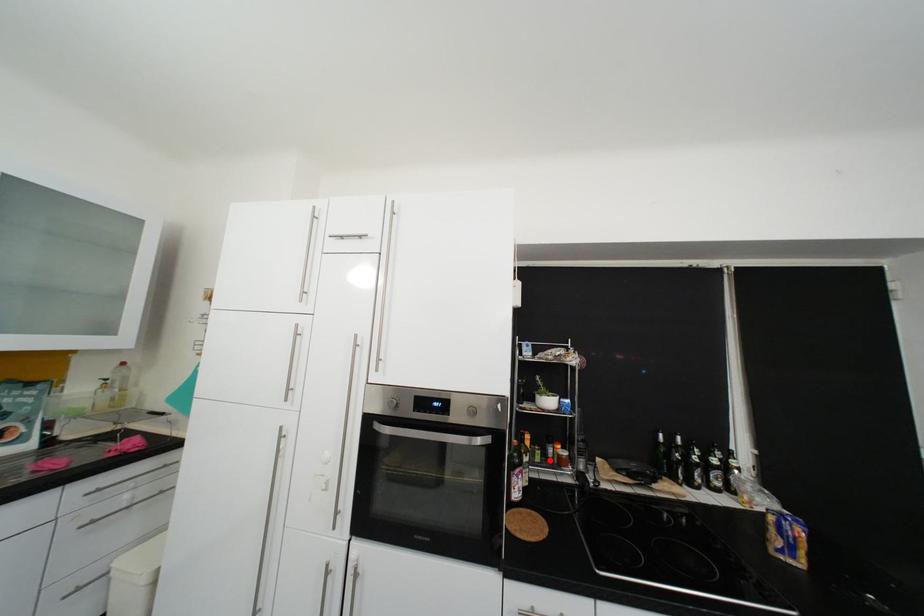
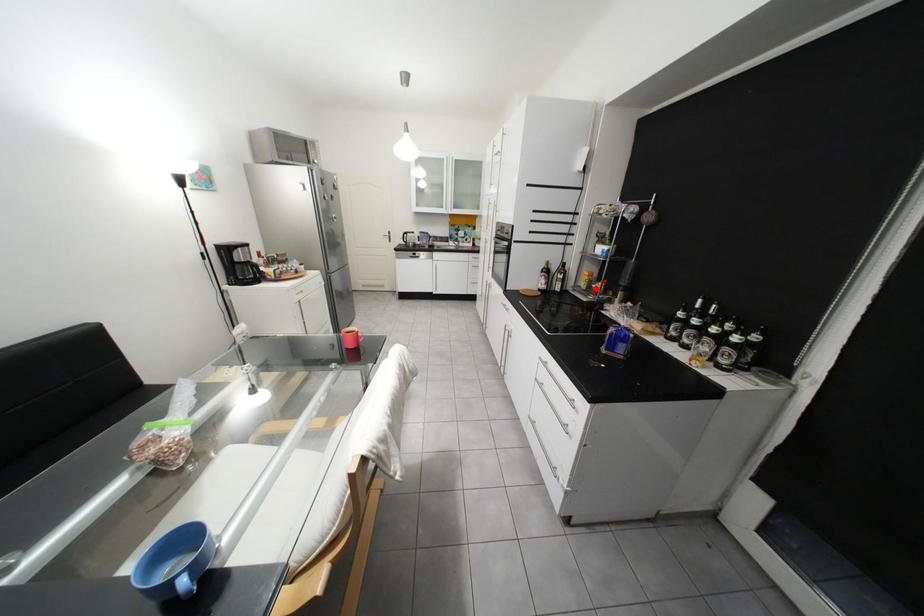
I am providing you with two images of the same scene from different viewpoints. A red point is marked on the first image and another point is marked on the second image. Does the point marked in image1 correspond to the same location as the one in image2?

Yes